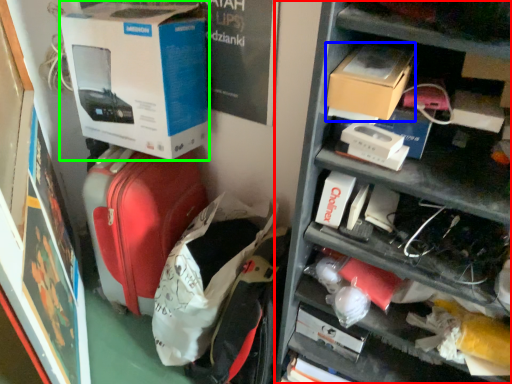
Question: Which object is the farthest from shelf (highlighted by a red box)? Choose among these: cardboard box (highlighted by a blue box) or box (highlighted by a green box).

Choices:
 (A) cardboard box
 (B) box

Answer: (B)